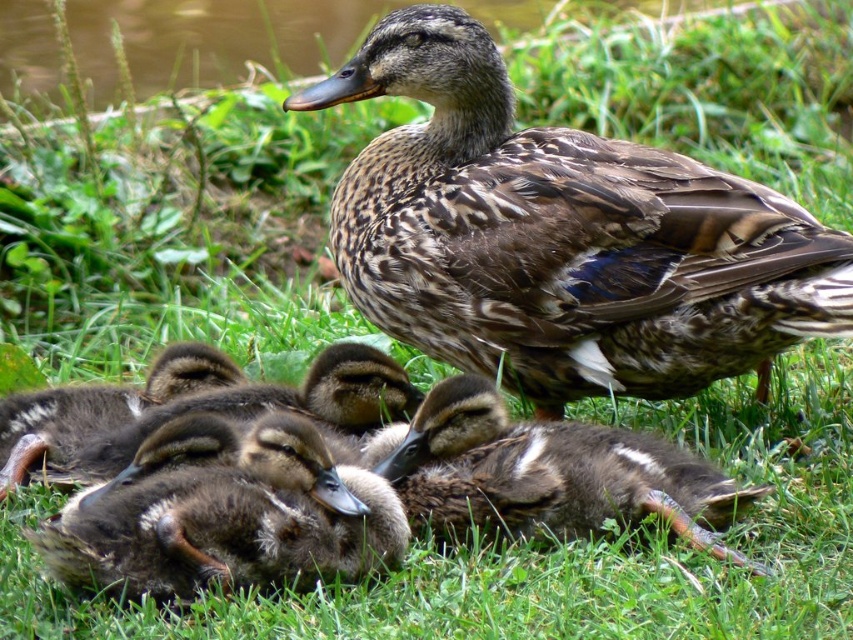
Is brown fluffy duckling at lower center thinner than brown downy duckling at center?

Yes, brown fluffy duckling at lower center is thinner than brown downy duckling at center.

The width and height of the screenshot is (853, 640). In order to click on brown fluffy duckling at lower center in this screenshot , I will do `click(225, 515)`.

Who is positioned more to the left, brown speckled feathers at center or brown downy duckling at center?

brown downy duckling at center is more to the left.

Does point (364, 236) lie in front of point (688, 477)?

No, (364, 236) is behind (688, 477).

Locate an element on the screen. brown speckled feathers at center is located at coordinates (561, 237).

Is brown speckled feathers at center shorter than brown fluffy duckling at lower center?

In fact, brown speckled feathers at center may be taller than brown fluffy duckling at lower center.

Between brown speckled feathers at center and brown fluffy duckling at lower center, which one appears on the right side from the viewer's perspective?

brown speckled feathers at center

Is point (570, 198) positioned behind point (335, 509)?

Yes, point (570, 198) is behind point (335, 509).

Where is `brown speckled feathers at center`? This screenshot has height=640, width=853. brown speckled feathers at center is located at coordinates (561, 237).